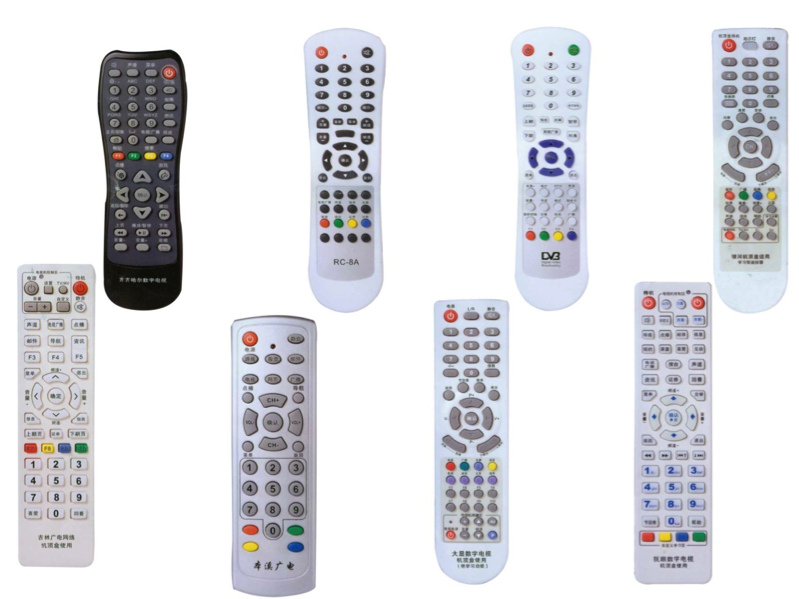
Identify the location of remote controls. Image resolution: width=799 pixels, height=599 pixels. (56, 267), (276, 320), (471, 300), (668, 279), (748, 29), (547, 32), (344, 37), (134, 62).